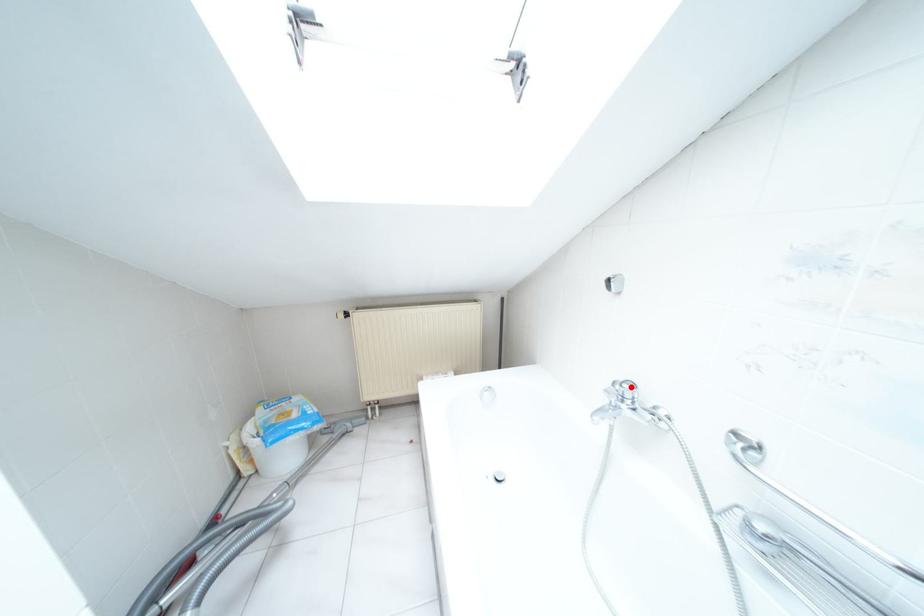
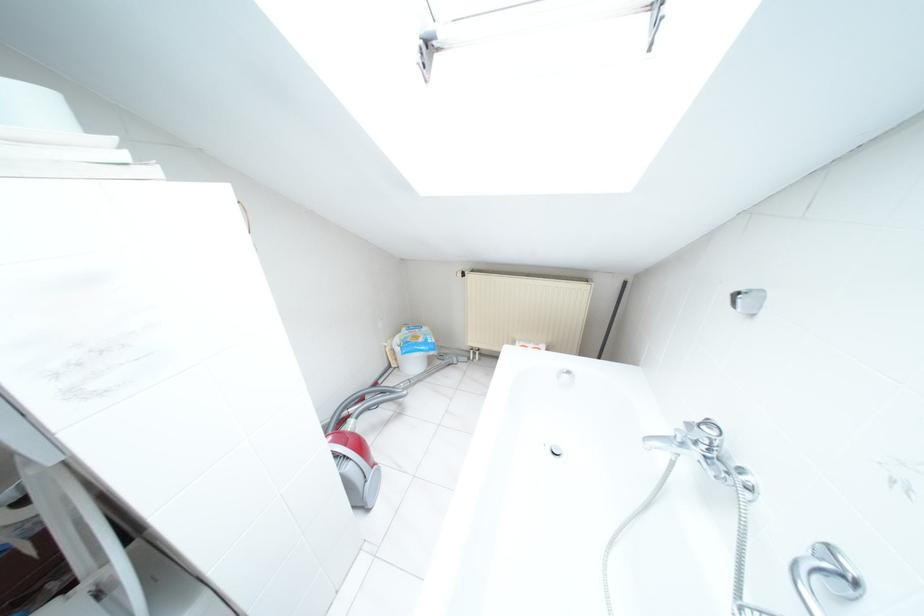
Question: I am providing you with two images of the same scene from different viewpoints. In image1, a red point is highlighted. Considering the same 3D point in image2, which of the following is correct?

Choices:
 (A) It is closer
 (B) It is farther

Answer: (B)